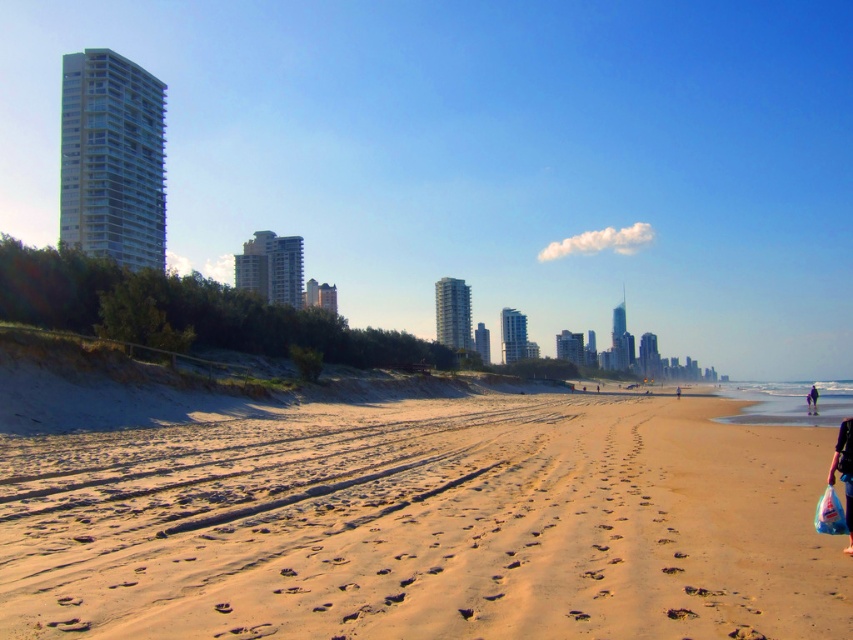
Question: Which point appears farthest from the camera in this image?

Choices:
 (A) (807, 406)
 (B) (442, 561)

Answer: (A)

Question: Can you confirm if sandy beach at lower center is bigger than black fabric person at lower right?

Choices:
 (A) yes
 (B) no

Answer: (B)

Question: Among these objects, which one is nearest to the camera?

Choices:
 (A) sandy beach at lower center
 (B) black fabric person at lower right

Answer: (A)

Question: Does sandy beach at lower center have a lesser width compared to black fabric person at lower right?

Choices:
 (A) no
 (B) yes

Answer: (B)

Question: Is the position of sandy beach at lower center less distant than that of black fabric person at lower right?

Choices:
 (A) no
 (B) yes

Answer: (B)

Question: Which point is farther to the camera?

Choices:
 (A) sandy beach at lower center
 (B) black fabric person at lower right

Answer: (B)